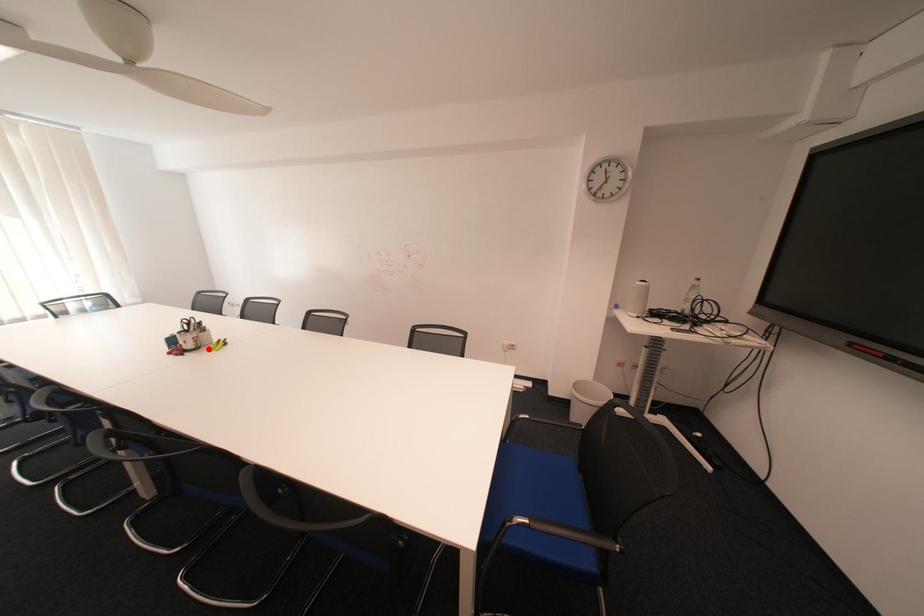
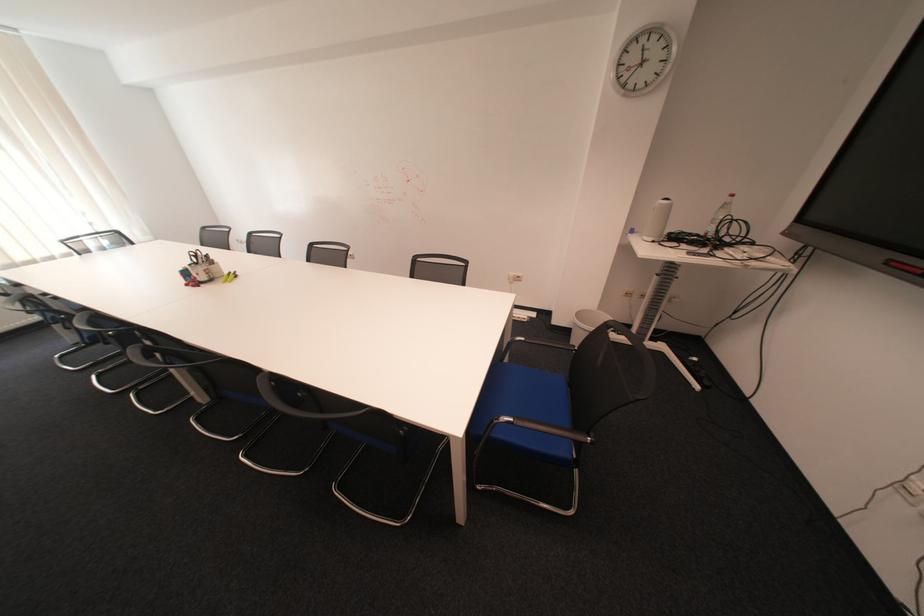
Where in the second image is the point corresponding to the highlighted location from the first image?

(223, 281)